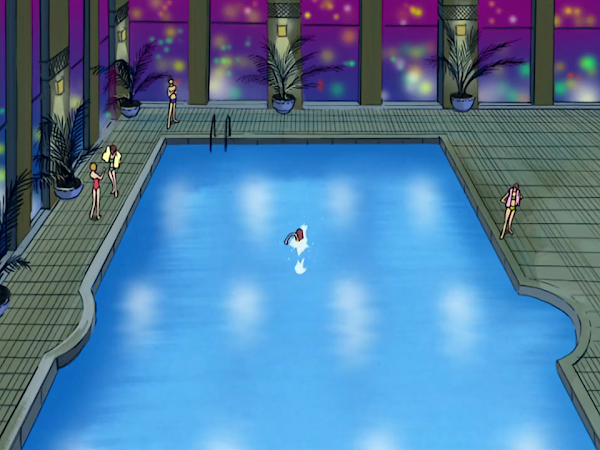
You are a GUI agent. You are given a task and a screenshot of the screen. Output one action in this format:
    pyautogui.click(x=<x>, y=<y>)
    Task: Click on the purple windows left side
    This screenshot has width=600, height=450.
    Given the screenshot: What is the action you would take?
    pyautogui.click(x=75, y=84), pyautogui.click(x=100, y=85), pyautogui.click(x=37, y=114)